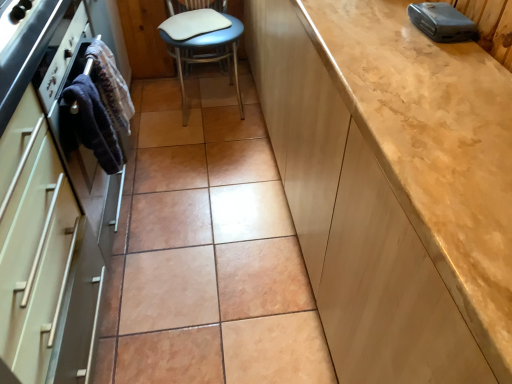
What is the approximate height of matte beige cabinet at right, marked as the 2th cabinetry in a left-to-right arrangement?

The height of matte beige cabinet at right, marked as the 2th cabinetry in a left-to-right arrangement, is 34.02 inches.

What do you see at coordinates (207, 53) in the screenshot?
I see `white leather chair at center` at bounding box center [207, 53].

Where is `dark blue fabric at left, arranged as the 1th material when viewed from the back`? The height and width of the screenshot is (384, 512). dark blue fabric at left, arranged as the 1th material when viewed from the back is located at coordinates (110, 85).

What are the coordinates of `matte white oven at left, which ranks as the 1th cabinetry in left-to-right order` in the screenshot? It's located at (49, 197).

From the image's perspective, which one is positioned higher, dark blue fabric at left, marked as the 2th material in a front-to-back arrangement, or matte beige cabinet at right, marked as the 2th cabinetry in a left-to-right arrangement?

matte beige cabinet at right, marked as the 2th cabinetry in a left-to-right arrangement.

Which object is wider, dark blue fabric at left, arranged as the 1th material when viewed from the back, or matte beige cabinet at right, marked as the first cabinetry in a right-to-left arrangement?

Wider between the two is matte beige cabinet at right, marked as the first cabinetry in a right-to-left arrangement.

This screenshot has height=384, width=512. In order to click on the 1st material positioned above the matte beige cabinet at right, marked as the 2th cabinetry in a left-to-right arrangement (from a real-world perspective) in this screenshot , I will do coord(110,85).

How many degrees apart are the facing directions of dark blue fabric at left, arranged as the 1th material when viewed from the back, and matte beige cabinet at right, marked as the 2th cabinetry in a left-to-right arrangement?

dark blue fabric at left, arranged as the 1th material when viewed from the back, and matte beige cabinet at right, marked as the 2th cabinetry in a left-to-right arrangement, are facing 178 degrees away from each other.

Is matte beige cabinet at right, marked as the first cabinetry in a right-to-left arrangement, taller or shorter than white leather chair at center?

matte beige cabinet at right, marked as the first cabinetry in a right-to-left arrangement, is taller than white leather chair at center.

Looking at this image, which is correct: matte beige cabinet at right, marked as the first cabinetry in a right-to-left arrangement, is inside white leather chair at center, or outside of it?

matte beige cabinet at right, marked as the first cabinetry in a right-to-left arrangement, is not enclosed by white leather chair at center.

Considering the points (345, 171) and (198, 59), which point is in front, point (345, 171) or point (198, 59)?

The point (345, 171) is more forward.

Considering the positions of objects matte beige cabinet at right, marked as the first cabinetry in a right-to-left arrangement, and white leather chair at center in the image provided, who is behind, matte beige cabinet at right, marked as the first cabinetry in a right-to-left arrangement, or white leather chair at center?

Positioned behind is white leather chair at center.

Between dark blue fabric at left, marked as the 2th material in a front-to-back arrangement, and dark blue fabric towel at left, the 2th material positioned from the back, which one has more height?

dark blue fabric at left, marked as the 2th material in a front-to-back arrangement.

Can we say dark blue fabric at left, arranged as the 1th material when viewed from the back, lies outside dark blue fabric towel at left, the 2th material positioned from the back?

That's correct, dark blue fabric at left, arranged as the 1th material when viewed from the back, is outside of dark blue fabric towel at left, the 2th material positioned from the back.

Between point (90, 62) and point (94, 73), which one is positioned in front?

The point (90, 62) is in front.

Is dark blue fabric at left, arranged as the 1th material when viewed from the back, directly adjacent to dark blue fabric towel at left, the 1th material when ordered from front to back?

Yes, dark blue fabric at left, arranged as the 1th material when viewed from the back, is next to dark blue fabric towel at left, the 1th material when ordered from front to back.

Which of these two, white leather chair at center or dark blue fabric at left, arranged as the 1th material when viewed from the back, stands taller?

white leather chair at center is taller.

I want to click on chair that is under the dark blue fabric at left, arranged as the 1th material when viewed from the back (from a real-world perspective), so click(207, 53).

Is white leather chair at center wider than dark blue fabric at left, arranged as the 1th material when viewed from the back?

Correct, the width of white leather chair at center exceeds that of dark blue fabric at left, arranged as the 1th material when viewed from the back.

From the image's perspective, is white leather chair at center above or below dark blue fabric at left, arranged as the 1th material when viewed from the back?

white leather chair at center is above dark blue fabric at left, arranged as the 1th material when viewed from the back.

Between matte white oven at left, which ranks as the 1th cabinetry in left-to-right order, and dark blue fabric at left, marked as the 2th material in a front-to-back arrangement, which one has less height?

dark blue fabric at left, marked as the 2th material in a front-to-back arrangement, is shorter.

From a real-world perspective, between matte white oven at left, which ranks as the 1th cabinetry in left-to-right order, and dark blue fabric at left, arranged as the 1th material when viewed from the back, who is vertically lower?

In real-world perspective, matte white oven at left, which ranks as the 1th cabinetry in left-to-right order, is lower.

From the image's perspective, is matte white oven at left, the second cabinetry viewed from the right, under dark blue fabric at left, marked as the 2th material in a front-to-back arrangement?

Yes, from the image's perspective, matte white oven at left, the second cabinetry viewed from the right, is beneath dark blue fabric at left, marked as the 2th material in a front-to-back arrangement.

Does point (52, 221) come closer to viewer compared to point (108, 76)?

Yes, it is in front of point (108, 76).

The width and height of the screenshot is (512, 384). In order to click on chair that appears above the dark blue fabric towel at left, the 1th material when ordered from front to back (from the image's perspective) in this screenshot , I will do `click(207, 53)`.

Is dark blue fabric towel at left, the 1th material when ordered from front to back, surrounded by white leather chair at center?

No, dark blue fabric towel at left, the 1th material when ordered from front to back, is not surrounded by white leather chair at center.

Which is less distant, (219,35) or (91,93)?

Clearly, point (219,35) is more distant from the camera than point (91,93).

Can you confirm if white leather chair at center is bigger than dark blue fabric towel at left, the 2th material positioned from the back?

Indeed, white leather chair at center has a larger size compared to dark blue fabric towel at left, the 2th material positioned from the back.

Is dark blue fabric towel at left, the 2th material positioned from the back, inside or outside of white leather chair at center?

The correct answer is: outside.

Is white leather chair at center at the back of dark blue fabric towel at left, the 1th material when ordered from front to back?

That's not correct — dark blue fabric towel at left, the 1th material when ordered from front to back, is not looking away from white leather chair at center.

Can you confirm if dark blue fabric towel at left, the 2th material positioned from the back, is smaller than white leather chair at center?

Yes.

From a real-world perspective, count 1st materials upward from the matte beige cabinet at right, marked as the 2th cabinetry in a left-to-right arrangement, and point to it. Please provide its 2D coordinates.

[(110, 85)]

Where is `chair that appears below the matte beige cabinet at right, marked as the first cabinetry in a right-to-left arrangement (from a real-world perspective)`? This screenshot has width=512, height=384. chair that appears below the matte beige cabinet at right, marked as the first cabinetry in a right-to-left arrangement (from a real-world perspective) is located at coordinates (207, 53).

Based on the photo, based on their spatial positions, is matte beige cabinet at right, marked as the first cabinetry in a right-to-left arrangement, or dark blue fabric at left, arranged as the 1th material when viewed from the back, further from matte white oven at left, the second cabinetry viewed from the right?

matte beige cabinet at right, marked as the first cabinetry in a right-to-left arrangement, lies further to matte white oven at left, the second cabinetry viewed from the right, than the other object.

In the scene shown: When comparing their distances from dark blue fabric towel at left, the 1th material when ordered from front to back, does white leather chair at center or dark blue fabric at left, arranged as the 1th material when viewed from the back, seem further?

Based on the image, white leather chair at center appears to be further to dark blue fabric towel at left, the 1th material when ordered from front to back.

When comparing their distances from matte beige cabinet at right, marked as the 2th cabinetry in a left-to-right arrangement, does white leather chair at center or matte white oven at left, the second cabinetry viewed from the right, seem further?

The object further to matte beige cabinet at right, marked as the 2th cabinetry in a left-to-right arrangement, is white leather chair at center.

Considering their positions, is dark blue fabric towel at left, the 2th material positioned from the back, positioned further to white leather chair at center than matte white oven at left, the second cabinetry viewed from the right?

matte white oven at left, the second cabinetry viewed from the right, lies further to white leather chair at center than the other object.

Which object lies further to the anchor point dark blue fabric towel at left, the 2th material positioned from the back, matte beige cabinet at right, marked as the first cabinetry in a right-to-left arrangement, or matte white oven at left, which ranks as the 1th cabinetry in left-to-right order?

Based on the image, matte beige cabinet at right, marked as the first cabinetry in a right-to-left arrangement, appears to be further to dark blue fabric towel at left, the 2th material positioned from the back.

Based on their spatial positions, is matte beige cabinet at right, marked as the 2th cabinetry in a left-to-right arrangement, or dark blue fabric towel at left, the 1th material when ordered from front to back, further from white leather chair at center?

The object further to white leather chair at center is matte beige cabinet at right, marked as the 2th cabinetry in a left-to-right arrangement.

Estimate the real-world distances between objects in this image. Which object is further from white leather chair at center, matte beige cabinet at right, marked as the 2th cabinetry in a left-to-right arrangement, or matte white oven at left, the second cabinetry viewed from the right?

Based on the image, matte beige cabinet at right, marked as the 2th cabinetry in a left-to-right arrangement, appears to be further to white leather chair at center.

Looking at the image, which one is located further to matte beige cabinet at right, marked as the 2th cabinetry in a left-to-right arrangement, matte white oven at left, which ranks as the 1th cabinetry in left-to-right order, or dark blue fabric towel at left, the 2th material positioned from the back?

dark blue fabric towel at left, the 2th material positioned from the back, is further to matte beige cabinet at right, marked as the 2th cabinetry in a left-to-right arrangement.

This screenshot has width=512, height=384. I want to click on material between matte white oven at left, the second cabinetry viewed from the right, and dark blue fabric at left, arranged as the 1th material when viewed from the back, in the front-back direction, so click(101, 106).

Where is `material located between matte beige cabinet at right, marked as the first cabinetry in a right-to-left arrangement, and dark blue fabric at left, arranged as the 1th material when viewed from the back, in the depth direction`? material located between matte beige cabinet at right, marked as the first cabinetry in a right-to-left arrangement, and dark blue fabric at left, arranged as the 1th material when viewed from the back, in the depth direction is located at coordinates (101, 106).

The width and height of the screenshot is (512, 384). I want to click on cabinetry between matte beige cabinet at right, marked as the first cabinetry in a right-to-left arrangement, and white leather chair at center, along the z-axis, so click(x=49, y=197).

Image resolution: width=512 pixels, height=384 pixels. Identify the location of material positioned between dark blue fabric towel at left, the 2th material positioned from the back, and white leather chair at center from near to far. (110, 85).